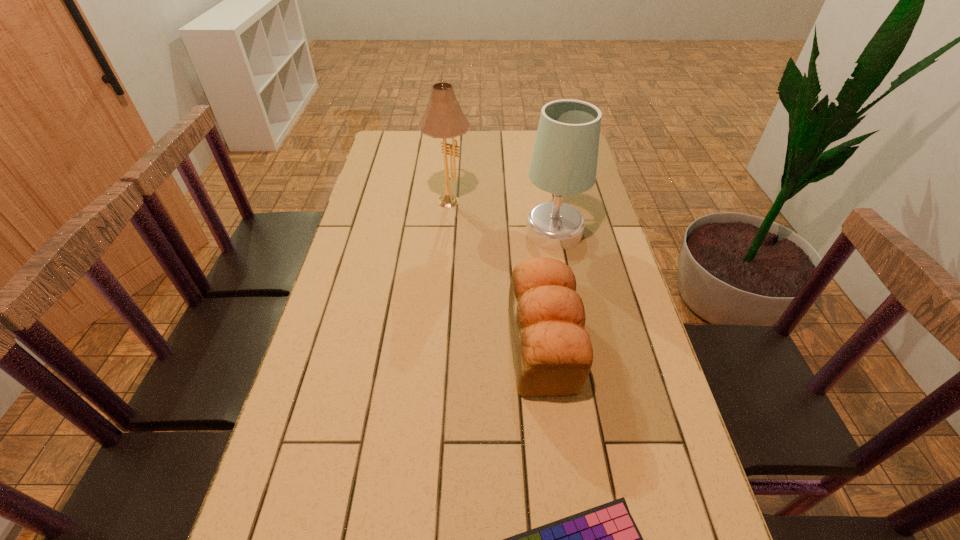
Identify which object is the closest to the farther lampshade. Please provide its 2D coordinates. Your answer should be formatted as a tuple, i.e. [(x, y)], where the tuple contains the x and y coordinates of a point satisfying the conditions above.

[(564, 162)]

Locate which object is the closest to the farther lampshade. Please provide its 2D coordinates. Your answer should be formatted as a tuple, i.e. [(x, y)], where the tuple contains the x and y coordinates of a point satisfying the conditions above.

[(564, 162)]

In order to click on vacant area that satisfies the following two spatial constraints: 1. on the base of the third nearest object; 2. on the front side of the second nearest object in this screenshot , I will do `click(575, 346)`.

The height and width of the screenshot is (540, 960). In order to click on vacant position in the image that satisfies the following two spatial constraints: 1. on the front side of the second shortest object; 2. on the left side of the farthest object in this screenshot , I will do `click(436, 346)`.

Where is `free space that satisfies the following two spatial constraints: 1. on the base of the right lampshade; 2. on the front side of the third farthest object`? The height and width of the screenshot is (540, 960). free space that satisfies the following two spatial constraints: 1. on the base of the right lampshade; 2. on the front side of the third farthest object is located at coordinates (575, 346).

You are a GUI agent. You are given a task and a screenshot of the screen. Output one action in this format:
    pyautogui.click(x=<x>, y=<y>)
    Task: Click on the vacant space that satisfies the following two spatial constraints: 1. on the base of the right lampshade; 2. on the front side of the bread
    
    Given the screenshot: What is the action you would take?
    pyautogui.click(x=575, y=346)